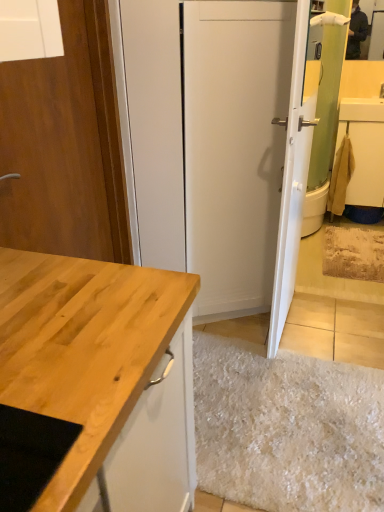
Locate an element on the screen. The width and height of the screenshot is (384, 512). white glossy door at upper right, the 2th door when ordered from left to right is located at coordinates (292, 181).

Between beige fabric towel at right and white glossy door at upper right, which appears as the 1th door when viewed from the right, which one has smaller size?

With smaller size is beige fabric towel at right.

Would you say white glossy door at upper right, which appears as the 1th door when viewed from the right, is part of beige fabric towel at right's contents?

No, white glossy door at upper right, which appears as the 1th door when viewed from the right, is not surrounded by beige fabric towel at right.

From the image's perspective, is beige fabric towel at right above or below white glossy door at upper right, the 2th door when ordered from left to right?

From the image's perspective, beige fabric towel at right appears above white glossy door at upper right, the 2th door when ordered from left to right.

In the scene shown: Considering the sizes of white glossy door at upper right, the 2th door when ordered from left to right, and wooden door at left, which is the second door from right to left, in the image, is white glossy door at upper right, the 2th door when ordered from left to right, taller or shorter than wooden door at left, which is the second door from right to left,?

Clearly, white glossy door at upper right, the 2th door when ordered from left to right, is taller compared to wooden door at left, which is the second door from right to left.

Looking at this image, is wooden door at left, which is the second door from right to left, at the back of white glossy door at upper right, which appears as the 1th door when viewed from the right?

That's not correct — white glossy door at upper right, which appears as the 1th door when viewed from the right, is not looking away from wooden door at left, which is the second door from right to left.

How much distance is there between white glossy door at upper right, which appears as the 1th door when viewed from the right, and wooden door at left, which is the second door from right to left?

33.41 inches.

Would you consider white glossy door at upper right, which appears as the 1th door when viewed from the right, to be distant from wooden door at left, acting as the first door starting from the left?

No, white glossy door at upper right, which appears as the 1th door when viewed from the right, is in close proximity to wooden door at left, acting as the first door starting from the left.

Which object is closer to the camera taking this photo, beige fabric towel at right or wooden door at left, which is the second door from right to left?

wooden door at left, which is the second door from right to left.

Which object is positioned more to the right, beige fabric towel at right or wooden door at left, acting as the first door starting from the left?

From the viewer's perspective, beige fabric towel at right appears more on the right side.

Is beige fabric towel at right positioned far away from wooden door at left, acting as the first door starting from the left?

Yes, beige fabric towel at right is far from wooden door at left, acting as the first door starting from the left.

Considering the points (354, 135) and (113, 180), which point is behind, point (354, 135) or point (113, 180)?

Positioned behind is point (354, 135).

Can you confirm if wooden door at left, which is the second door from right to left, is bigger than beige fabric towel at right?

Actually, wooden door at left, which is the second door from right to left, might be smaller than beige fabric towel at right.

Find the location of a particular element. the 2nd door to the left of the beige fabric towel at right, counting from the anchor's position is located at coordinates (65, 145).

Is point (57, 222) positioned in front of point (364, 137)?

Yes, point (57, 222) is closer to viewer.

Looking at this image, considering the positions of objects wooden door at left, which is the second door from right to left, and white glossy door at upper right, the 2th door when ordered from left to right, in the image provided, who is behind, wooden door at left, which is the second door from right to left, or white glossy door at upper right, the 2th door when ordered from left to right,?

white glossy door at upper right, the 2th door when ordered from left to right, is further away from the camera.

Is wooden door at left, acting as the first door starting from the left, taller or shorter than white glossy door at upper right, the 2th door when ordered from left to right?

Clearly, wooden door at left, acting as the first door starting from the left, is shorter compared to white glossy door at upper right, the 2th door when ordered from left to right.

From a real-world perspective, who is located higher, wooden door at left, acting as the first door starting from the left, or white glossy door at upper right, which appears as the 1th door when viewed from the right?

From a 3D spatial view, wooden door at left, acting as the first door starting from the left, is above.

In the scene shown: Is wooden door at left, which is the second door from right to left, next to white glossy door at upper right, which appears as the 1th door when viewed from the right, and touching it?

No, wooden door at left, which is the second door from right to left, is not next to white glossy door at upper right, which appears as the 1th door when viewed from the right.

Looking at this image, from the image's perspective, which is above, white glossy door at upper right, the 2th door when ordered from left to right, or beige fabric towel at right?

From the image's view, beige fabric towel at right is above.

Does white glossy door at upper right, the 2th door when ordered from left to right, have a larger size compared to beige fabric towel at right?

Yes.

From a real-world perspective, is white glossy door at upper right, which appears as the 1th door when viewed from the right, physically located above or below beige fabric towel at right?

Clearly, from a real-world perspective, white glossy door at upper right, which appears as the 1th door when viewed from the right, is above beige fabric towel at right.

Which object is positioned more to the left, white glossy door at upper right, the 2th door when ordered from left to right, or beige fabric towel at right?

Positioned to the left is white glossy door at upper right, the 2th door when ordered from left to right.

Which door is the 1st one when counting from the front of the beige fabric towel at right? Please provide its 2D coordinates.

[(292, 181)]

Where is `door below the white glossy door at upper right, the 2th door when ordered from left to right (from the image's perspective)`? door below the white glossy door at upper right, the 2th door when ordered from left to right (from the image's perspective) is located at coordinates (65, 145).

Considering their positions, is beige fabric towel at right positioned closer to wooden door at left, acting as the first door starting from the left, than white glossy door at upper right, the 2th door when ordered from left to right?

white glossy door at upper right, the 2th door when ordered from left to right.

Considering their positions, is wooden door at left, which is the second door from right to left, positioned further to white glossy door at upper right, which appears as the 1th door when viewed from the right, than beige fabric towel at right?

beige fabric towel at right is positioned further to the anchor white glossy door at upper right, which appears as the 1th door when viewed from the right.

Considering their positions, is white glossy door at upper right, the 2th door when ordered from left to right, positioned further to beige fabric towel at right than wooden door at left, acting as the first door starting from the left?

Among the two, wooden door at left, acting as the first door starting from the left, is located further to beige fabric towel at right.

Estimate the real-world distances between objects in this image. Which object is further from white glossy door at upper right, the 2th door when ordered from left to right, beige fabric towel at right or wooden door at left, acting as the first door starting from the left?

Among the two, beige fabric towel at right is located further to white glossy door at upper right, the 2th door when ordered from left to right.

Which object lies further to the anchor point beige fabric towel at right, wooden door at left, acting as the first door starting from the left, or white glossy door at upper right, the 2th door when ordered from left to right?

The object further to beige fabric towel at right is wooden door at left, acting as the first door starting from the left.

Which object lies nearer to the anchor point wooden door at left, acting as the first door starting from the left, white glossy door at upper right, the 2th door when ordered from left to right, or beige fabric towel at right?

Among the two, white glossy door at upper right, the 2th door when ordered from left to right, is located nearer to wooden door at left, acting as the first door starting from the left.

This screenshot has width=384, height=512. What are the coordinates of `door between wooden door at left, which is the second door from right to left, and beige fabric towel at right from front to back` in the screenshot? It's located at (292, 181).